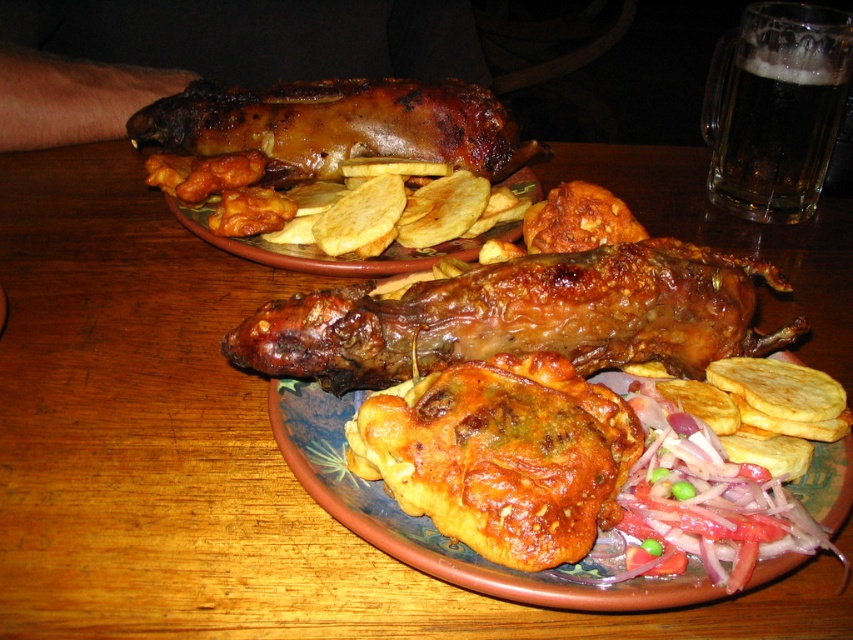
Question: Is golden-brown crispy chicken at center to the right of brown crispy pork at upper center from the viewer's perspective?

Choices:
 (A) yes
 (B) no

Answer: (A)

Question: Considering the real-world distances, which object is farthest from the brown crispy pork at upper center?

Choices:
 (A) brown crispy chicken wing at center
 (B) golden-brown crispy chicken at center
 (C) golden-brown crispy potato chips at center
 (D) foamy dark brown glass at upper right

Answer: (B)

Question: Is brown crispy pork at upper center thinner than foamy dark brown glass at upper right?

Choices:
 (A) no
 (B) yes

Answer: (A)

Question: Which object is the farthest from the brown crispy chicken wing at center?

Choices:
 (A) foamy dark brown glass at upper right
 (B) golden-brown crispy potato chips at center

Answer: (A)

Question: Which of the following is the farthest from the observer?

Choices:
 (A) golden-brown crispy chicken at center
 (B) golden-brown crispy potato chips at center
 (C) foamy dark brown glass at upper right

Answer: (C)

Question: Does golden-brown crispy chicken at center appear on the right side of golden-brown crispy potato chips at center?

Choices:
 (A) no
 (B) yes

Answer: (B)